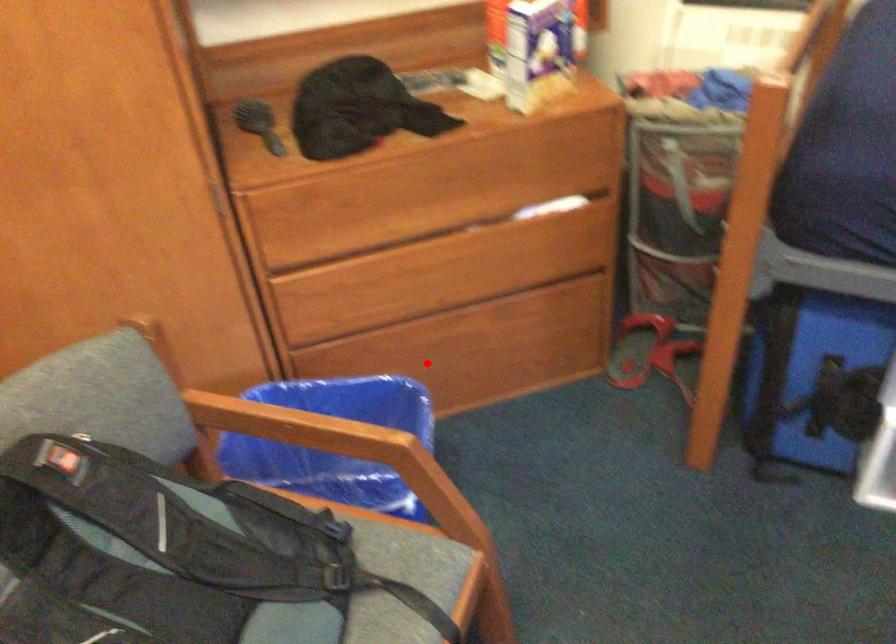
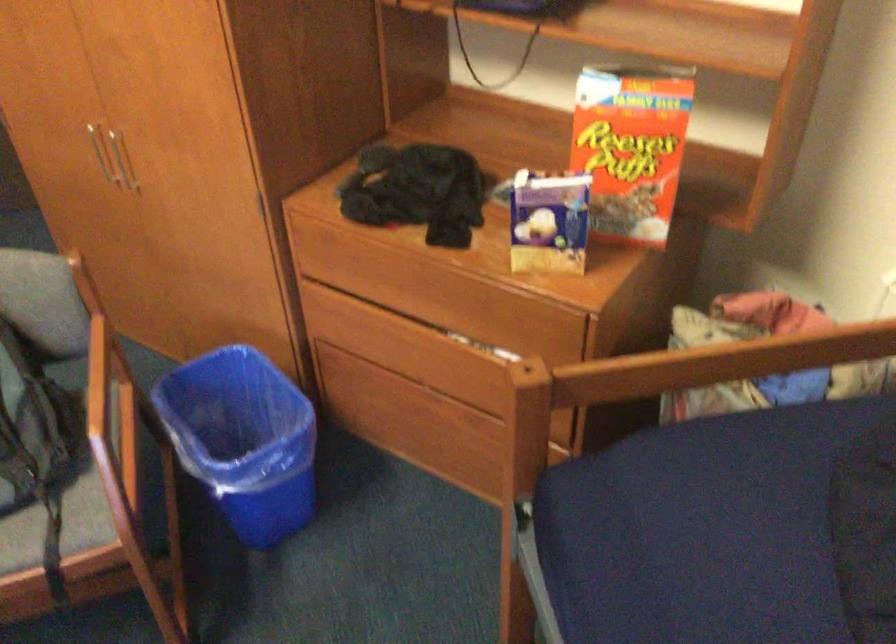
Find the pixel in the second image that matches the highlighted location in the first image.

(409, 419)